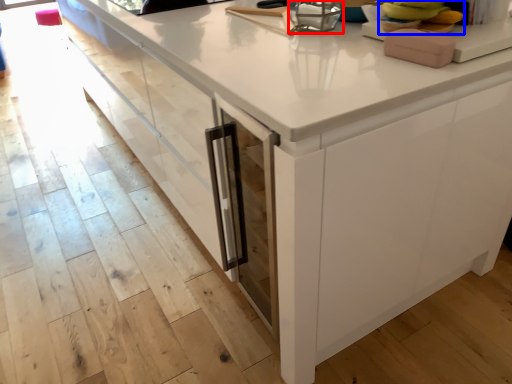
Question: Which point is closer to the camera, appliance (highlighted by a red box) or food (highlighted by a blue box)?

Choices:
 (A) appliance
 (B) food

Answer: (B)